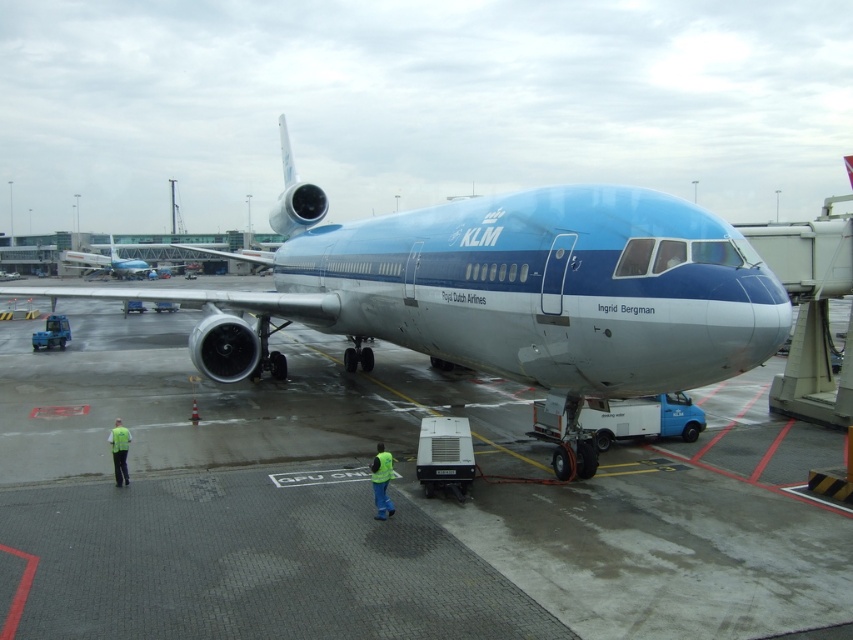
Does blue metallic airplane at center lie behind yellow reflective vest at lower left?

Yes, it is behind yellow reflective vest at lower left.

Can you confirm if blue metallic airplane at center is bigger than yellow reflective vest at lower left?

Indeed, blue metallic airplane at center has a larger size compared to yellow reflective vest at lower left.

The width and height of the screenshot is (853, 640). Describe the element at coordinates (109, 262) in the screenshot. I see `blue metallic airplane at center` at that location.

Image resolution: width=853 pixels, height=640 pixels. I want to click on blue metallic airplane at center, so click(x=109, y=262).

Can you confirm if concrete tarmac at center is positioned to the right of yellow reflective vest at lower left?

Indeed, concrete tarmac at center is positioned on the right side of yellow reflective vest at lower left.

The image size is (853, 640). What do you see at coordinates (474, 483) in the screenshot?
I see `concrete tarmac at center` at bounding box center [474, 483].

This screenshot has width=853, height=640. Describe the element at coordinates (474, 483) in the screenshot. I see `concrete tarmac at center` at that location.

The width and height of the screenshot is (853, 640). What are the coordinates of `concrete tarmac at center` in the screenshot? It's located at (474, 483).

Who is lower down, metallic blue airplane at center or yellow reflective vest at lower left?

yellow reflective vest at lower left is lower down.

Which is in front, point (460, 230) or point (125, 472)?

Point (125, 472) is more forward.

Which is in front, point (459, 320) or point (114, 461)?

Point (114, 461) is more forward.

The height and width of the screenshot is (640, 853). What are the coordinates of `metallic blue airplane at center` in the screenshot? It's located at (500, 289).